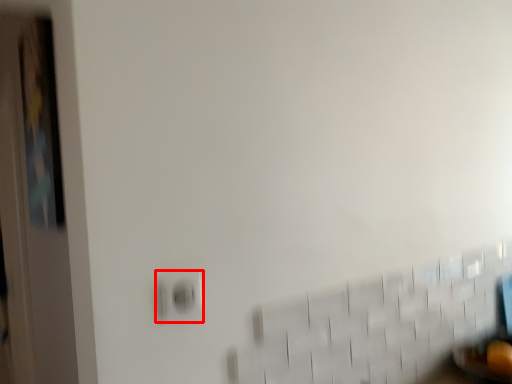
Question: From the image's perspective, where is electric outlet (annotated by the red box) located in relation to door in the image?

Choices:
 (A) above
 (B) below

Answer: (A)